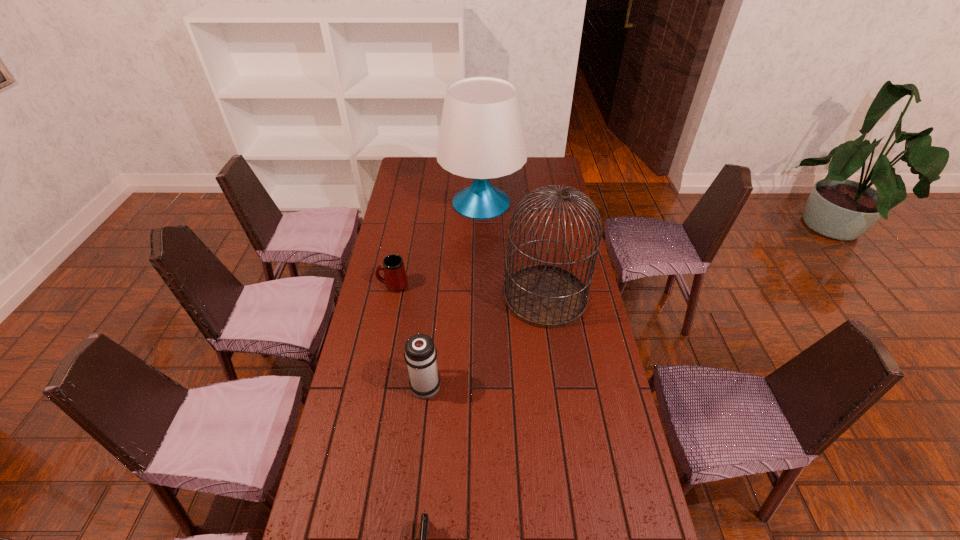
This screenshot has width=960, height=540. Find the location of `free space that satisfies the following two spatial constraints: 1. on the front-facing side of the birdcage; 2. on the left side of the farthest object`. free space that satisfies the following two spatial constraints: 1. on the front-facing side of the birdcage; 2. on the left side of the farthest object is located at coordinates (482, 297).

What are the coordinates of `free location that satisfies the following two spatial constraints: 1. on the front-facing side of the table lamp; 2. on the left side of the birdcage` in the screenshot? It's located at (482, 297).